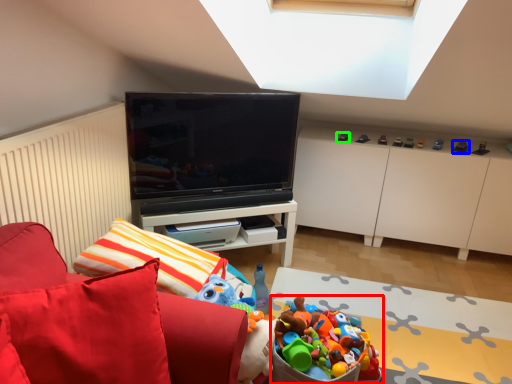
Question: Based on their relative distances, which object is farther from toy (highlighted by a red box)? Choose from toy (highlighted by a blue box) and toy (highlighted by a green box).

Choices:
 (A) toy
 (B) toy

Answer: (A)